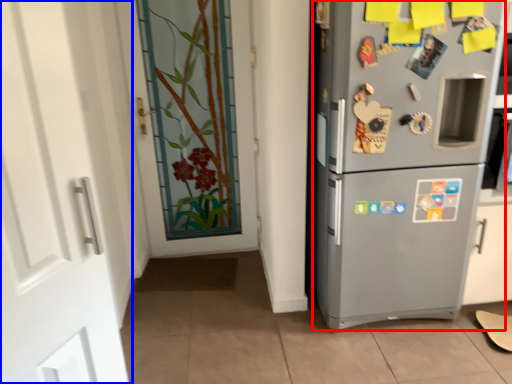
Question: Which object is further to the camera taking this photo, refrigerator (highlighted by a red box) or door (highlighted by a blue box)?

Choices:
 (A) refrigerator
 (B) door

Answer: (A)